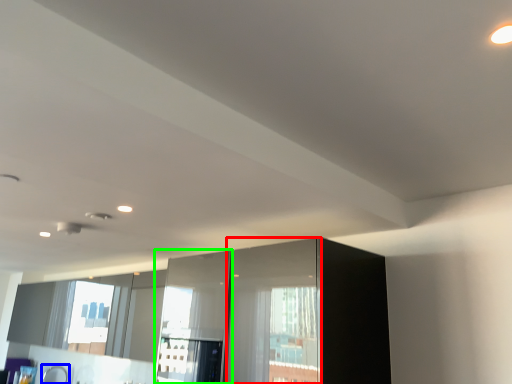
Question: Based on their relative distances, which object is farther from screen door (highlighted by a red box)? Choose from faucet (highlighted by a blue box) and screen door (highlighted by a green box).

Choices:
 (A) faucet
 (B) screen door

Answer: (A)